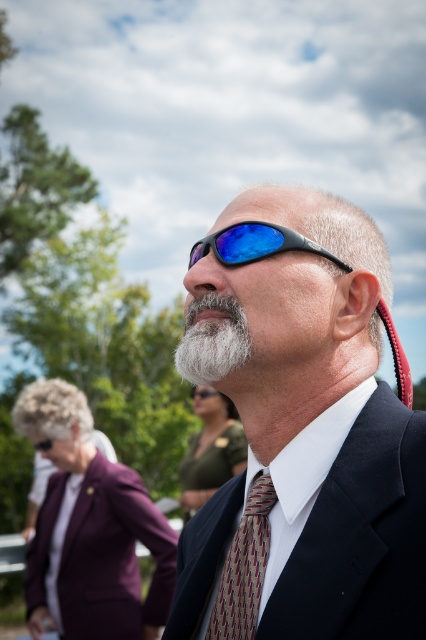
You are a fashion designer observing the man in the image. You need to determine if the matte black suit at center can be altered to fit the multicolored woven tie at center. Based on their sizes, is this feasible?

The matte black suit at center is larger in size than the multicolored woven tie at center, so it is feasible to alter the matte black suit at center to accommodate the multicolored woven tie at center since the suit has enough space.

You are a fashion designer analyzing the image. You need to determine the spatial relationship between the matte black suit at center and the blue reflective plastic goggles at center. Which object is positioned higher in the image?

The blue reflective plastic goggles at center are positioned higher than the matte black suit at center in the image.